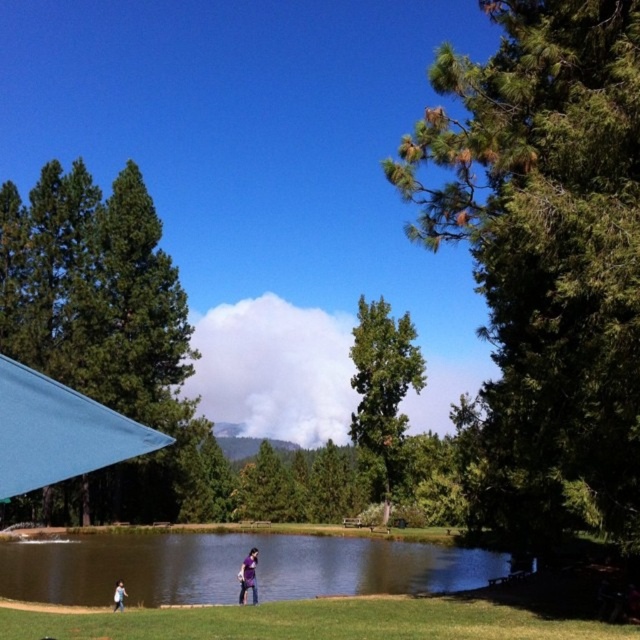
Consider the image. Is dark blue jeans at lower center to the left of light blue jeans at lower left from the viewer's perspective?

Incorrect, dark blue jeans at lower center is not on the left side of light blue jeans at lower left.

Is dark blue jeans at lower center thinner than light blue jeans at lower left?

In fact, dark blue jeans at lower center might be wider than light blue jeans at lower left.

Between point (244, 563) and point (122, 600), which one is positioned in front?

Positioned in front is point (122, 600).

This screenshot has height=640, width=640. I want to click on dark blue jeans at lower center, so click(x=248, y=577).

Is green matte tree at upper left thinner than green grass at lower center?

No, green matte tree at upper left is not thinner than green grass at lower center.

Between green matte tree at upper left and green grass at lower center, which one is positioned lower?

Positioned lower is green grass at lower center.

Who is more distant from viewer, (1, 208) or (13, 625)?

Point (1, 208)

Find the location of a particular element. green matte tree at upper left is located at coordinates (99, 328).

Is point (292, 614) closer to camera compared to point (248, 582)?

Yes, it is.

Does green grass at lower center have a lesser height compared to dark blue jeans at lower center?

No.

Identify the location of green grass at lower center. (310, 621).

Identify the location of green grass at lower center. The width and height of the screenshot is (640, 640). (310, 621).